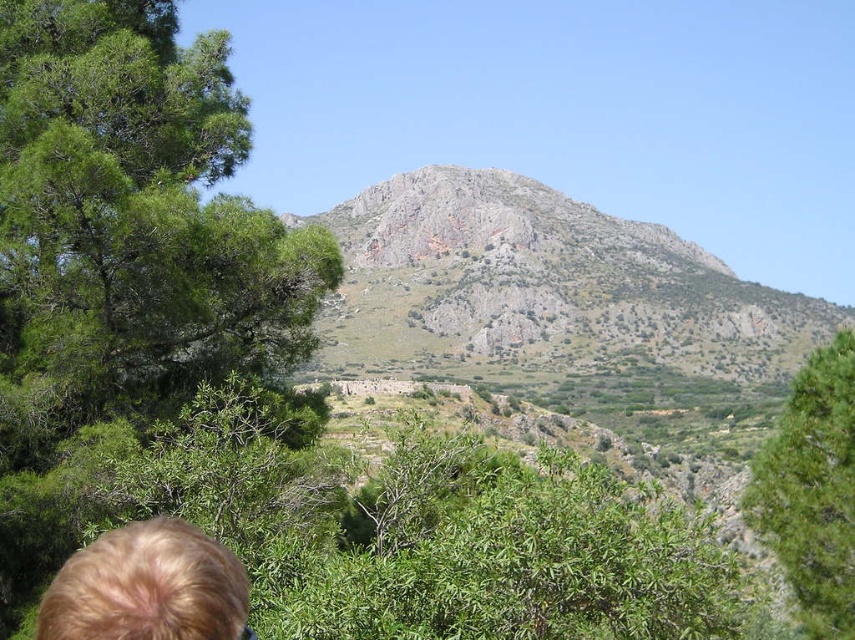
You are standing at the bottom left corner of the image and see the point marked at coordinates (137, 211). What object does this point correspond to?

The point at coordinates (137, 211) corresponds to the green leafy tree at left.

In the image, there is a point marked at coordinates (812, 490). Given the scene described, which object from the list corresponds to this coordinate? Please choose between the objects listed in the input.

The point at coordinates (812, 490) corresponds to the green leafy tree at center right.